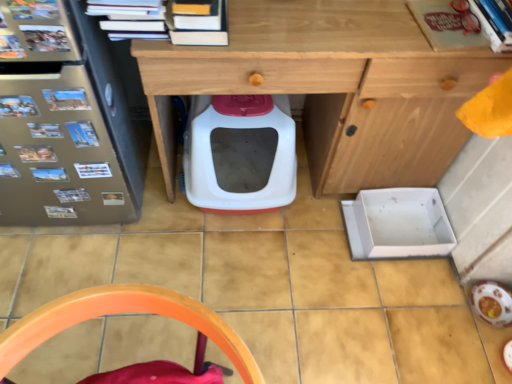
The width and height of the screenshot is (512, 384). Find the location of `empty space that is ontop of wooden desk at center`. empty space that is ontop of wooden desk at center is located at coordinates (353, 21).